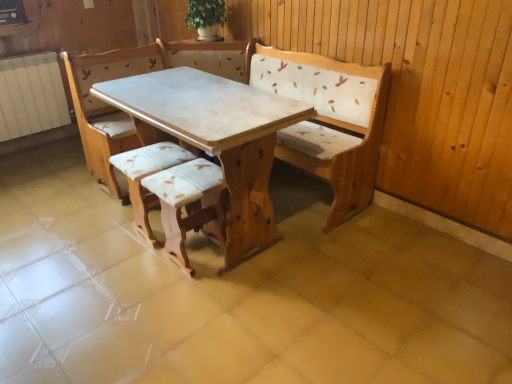
Find the location of a particular element. This screenshot has width=512, height=384. blank space to the left of white marble table at center is located at coordinates [x=71, y=236].